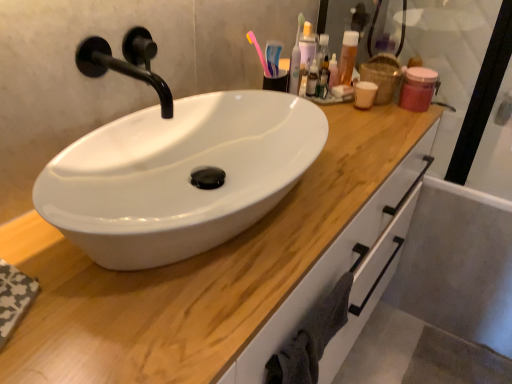
Where is `free space to the right of pink plastic toothbrush at upper right`? The image size is (512, 384). free space to the right of pink plastic toothbrush at upper right is located at coordinates (343, 122).